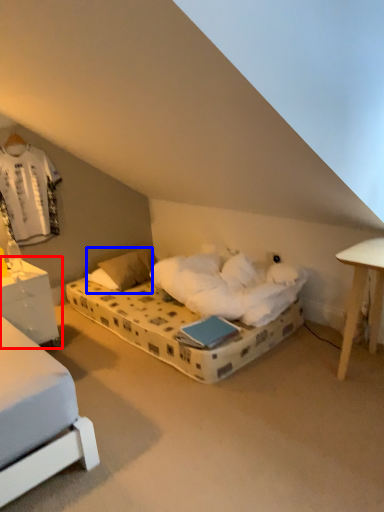
Question: Which object appears closest to the camera in this image, nightstand (highlighted by a red box) or pillow (highlighted by a blue box)?

Choices:
 (A) nightstand
 (B) pillow

Answer: (A)